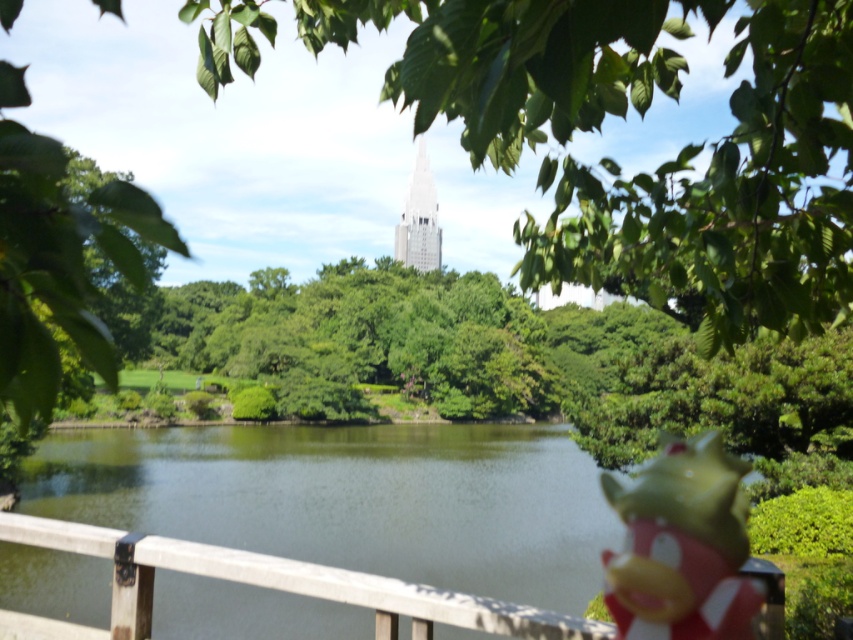
In the scene shown: Does green smooth water at center have a greater width compared to white glass tower at center?

Yes.

Looking at this image, between green smooth water at center and white glass tower at center, which one is positioned lower?

green smooth water at center is below.

The width and height of the screenshot is (853, 640). Describe the element at coordinates (352, 499) in the screenshot. I see `green smooth water at center` at that location.

Where is `green smooth water at center`? This screenshot has width=853, height=640. green smooth water at center is located at coordinates (352, 499).

Find the location of a particular element. white wood rail at lower center is located at coordinates (264, 586).

Where is `white wood rail at lower center`? The image size is (853, 640). white wood rail at lower center is located at coordinates (264, 586).

Find the location of a particular element. The height and width of the screenshot is (640, 853). white wood rail at lower center is located at coordinates (264, 586).

Is green smooth water at center smaller than rubber duck at lower right?

Incorrect, green smooth water at center is not smaller in size than rubber duck at lower right.

Measure the distance between point (x=518, y=492) and camera.

Point (x=518, y=492) is 154.08 feet away from camera.

The image size is (853, 640). What do you see at coordinates (352, 499) in the screenshot? I see `green smooth water at center` at bounding box center [352, 499].

The width and height of the screenshot is (853, 640). Find the location of `green smooth water at center`. green smooth water at center is located at coordinates (352, 499).